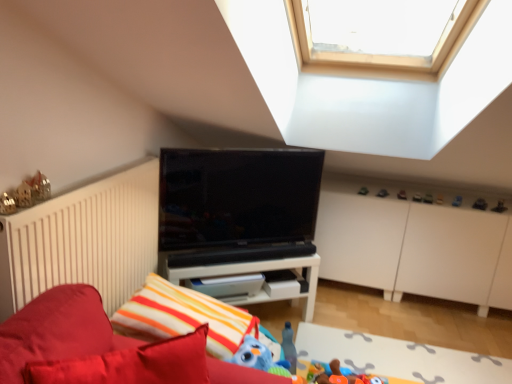
In order to click on free space that is to the left of matte black toy car at upper center, placed as the 7th toy when sorted from right to left in this screenshot , I will do `click(386, 192)`.